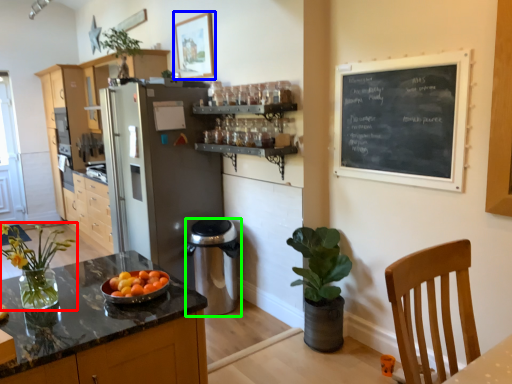
Question: Which object is positioned farthest from houseplant (highlighted by a red box)? Select from picture frame (highlighted by a blue box) and appliance (highlighted by a green box).

Choices:
 (A) picture frame
 (B) appliance

Answer: (A)